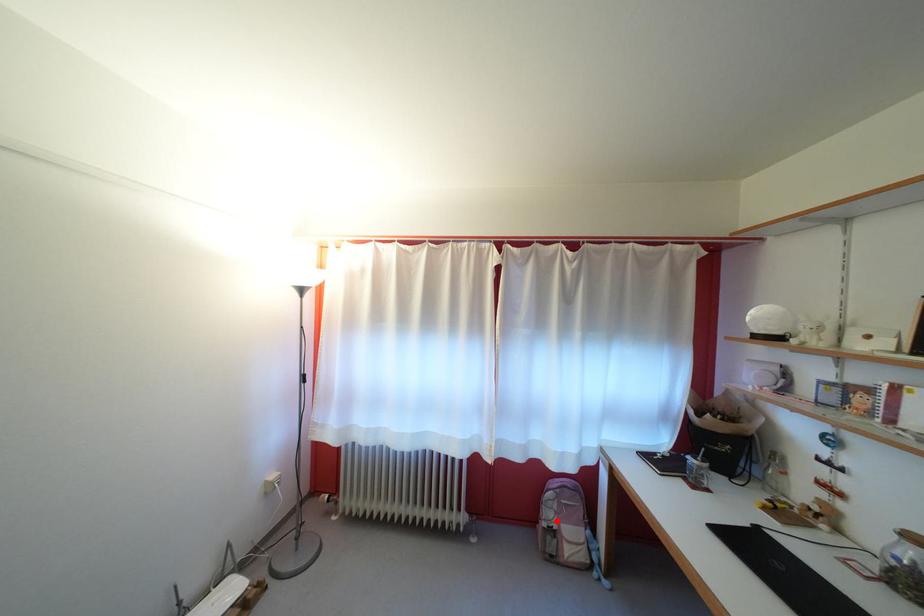
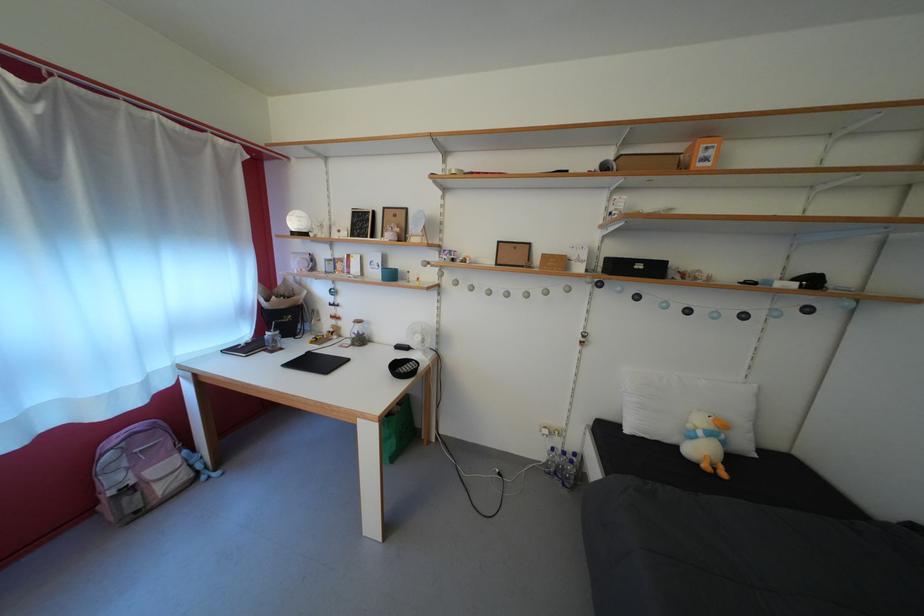
Where in the second image is the point corresponding to the highlighted location from the first image?

(123, 485)